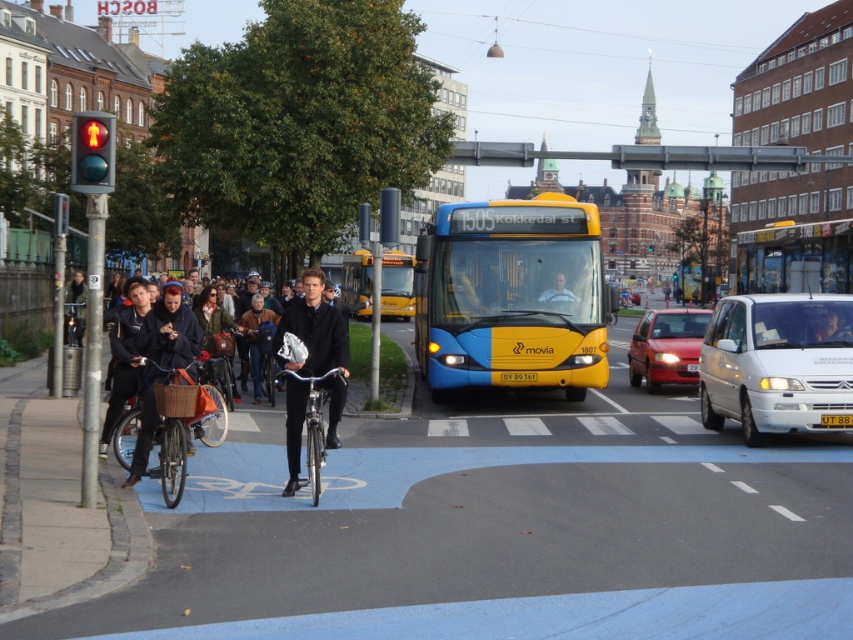
Question: Which object is the farthest from the silver metallic bicycle at center?

Choices:
 (A) white matte van at right
 (B) yellow and blue bus at center
 (C) yellow matte bus at center
 (D) red glass pedestrian signal at left

Answer: (C)

Question: Can you confirm if white matte van at right is positioned below silver metallic bicycle at center?

Choices:
 (A) yes
 (B) no

Answer: (B)

Question: Where is shiny red sedan at center located in relation to yellow matte bus at center in the image?

Choices:
 (A) above
 (B) below

Answer: (B)

Question: Is the position of blue/yellow plastic bus at center more distant than that of shiny red sedan at center?

Choices:
 (A) no
 (B) yes

Answer: (A)

Question: Which is farther from the yellow and blue bus at center?

Choices:
 (A) red glass pedestrian signal at left
 (B) brown leather jacket at center
 (C) shiny red sedan at center

Answer: (A)

Question: Which of these objects is positioned farthest from the shiny red sedan at center?

Choices:
 (A) matte brown bicycle at lower left
 (B) yellow matte bus at center

Answer: (B)